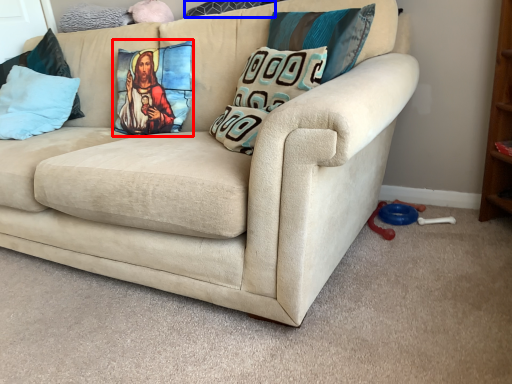
Question: Which of the following is the closest to the observer, pillow (highlighted by a red box) or pillow (highlighted by a blue box)?

Choices:
 (A) pillow
 (B) pillow

Answer: (A)